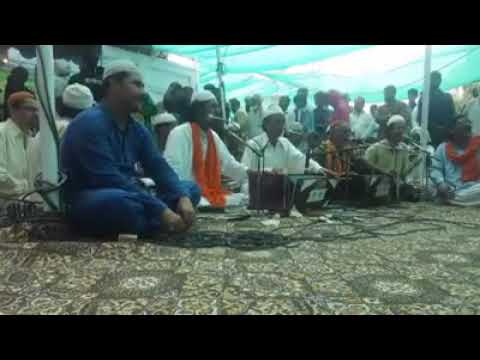
You are a GUI agent. You are given a task and a screenshot of the screen. Output one action in this format:
    pyautogui.click(x=<x>, y=<y>)
    Task: Click on the mic stands
    Image resolution: width=480 pixels, height=360 pixels.
    Given the screenshot: What is the action you would take?
    pyautogui.click(x=256, y=157), pyautogui.click(x=307, y=157), pyautogui.click(x=424, y=157)